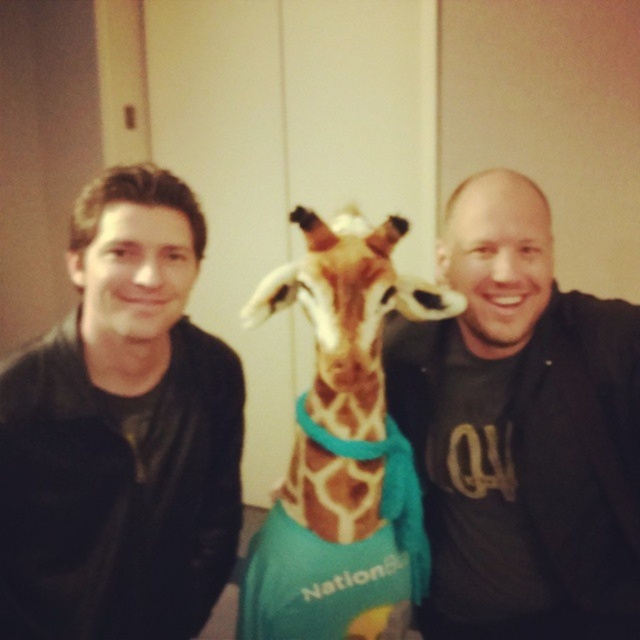
Question: Estimate the real-world distances between objects in this image. Which object is farther from the matte black shirt at right?

Choices:
 (A) spotted fur giraffe at center
 (B) black leather jacket at left

Answer: (B)

Question: Which of the following is the farthest from the observer?

Choices:
 (A) (353, 598)
 (B) (97, 422)
 (C) (627, 326)

Answer: (C)

Question: Can you confirm if black leather jacket at left is wider than spotted fur giraffe at center?

Choices:
 (A) yes
 (B) no

Answer: (B)

Question: Which point is closer to the camera?

Choices:
 (A) (6, 588)
 (B) (586, 552)
 (C) (312, 464)

Answer: (A)

Question: Can you confirm if black leather jacket at left is positioned above spotted fur giraffe at center?

Choices:
 (A) no
 (B) yes

Answer: (B)

Question: Can you confirm if matte black shirt at right is positioned to the right of spotted fur giraffe at center?

Choices:
 (A) no
 (B) yes

Answer: (B)